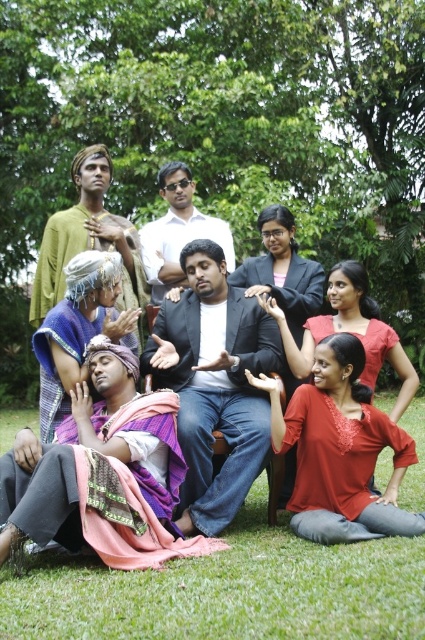
Question: Does matte red blouse at lower right appear over blue fabric headscarf at lower left?

Choices:
 (A) no
 (B) yes

Answer: (A)

Question: Is matte red blouse at lower right closer to the viewer compared to matte black suit at center?

Choices:
 (A) yes
 (B) no

Answer: (B)

Question: Does matte red blouse at lower right come behind green fabric turban at upper left?

Choices:
 (A) no
 (B) yes

Answer: (A)

Question: Which point is closer to the camera taking this photo?

Choices:
 (A) (8, 596)
 (B) (71, 353)
 (C) (223, 461)

Answer: (A)

Question: Which point is farther to the camera?

Choices:
 (A) white glossy shirt at center
 (B) green grass at lower center
 (C) matte red blouse at lower right
 (D) dark gray suit at center

Answer: (A)

Question: Which object is farther from the camera taking this photo?

Choices:
 (A) blue fabric headscarf at lower left
 (B) matte black suit at center

Answer: (A)